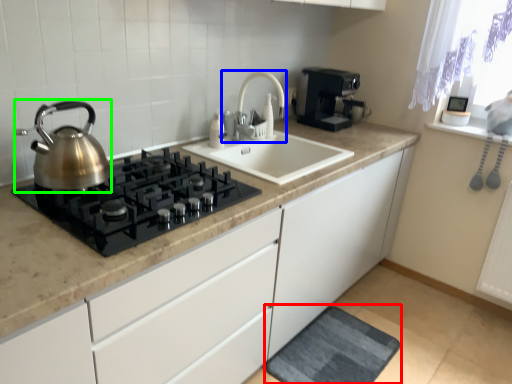
Question: Based on their relative distances, which object is nearer to bath mat (highlighted by a red box)? Choose from tap (highlighted by a blue box) and kettle (highlighted by a green box).

Choices:
 (A) tap
 (B) kettle

Answer: (A)